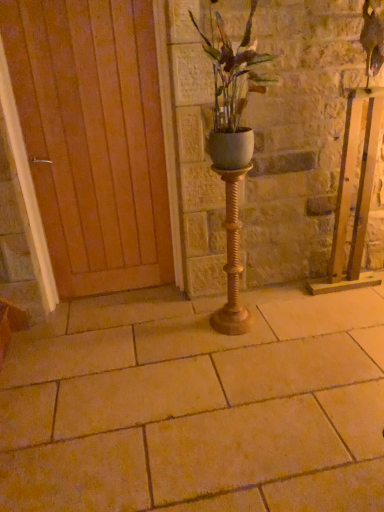
Locate an element on the screen. This screenshot has width=384, height=512. vacant area in front of gold textured candle holder at center is located at coordinates (236, 348).